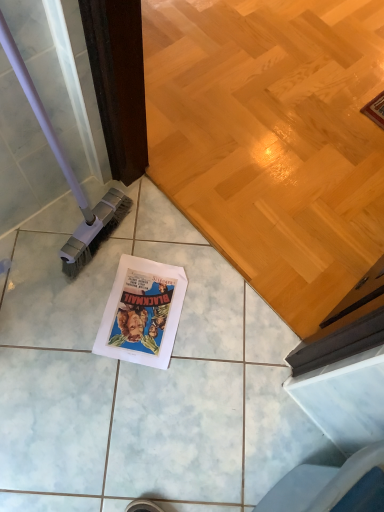
Locate an element on the screen. Image resolution: width=384 pixels, height=512 pixels. vacant space to the left of purple plastic brush at left is located at coordinates [46, 227].